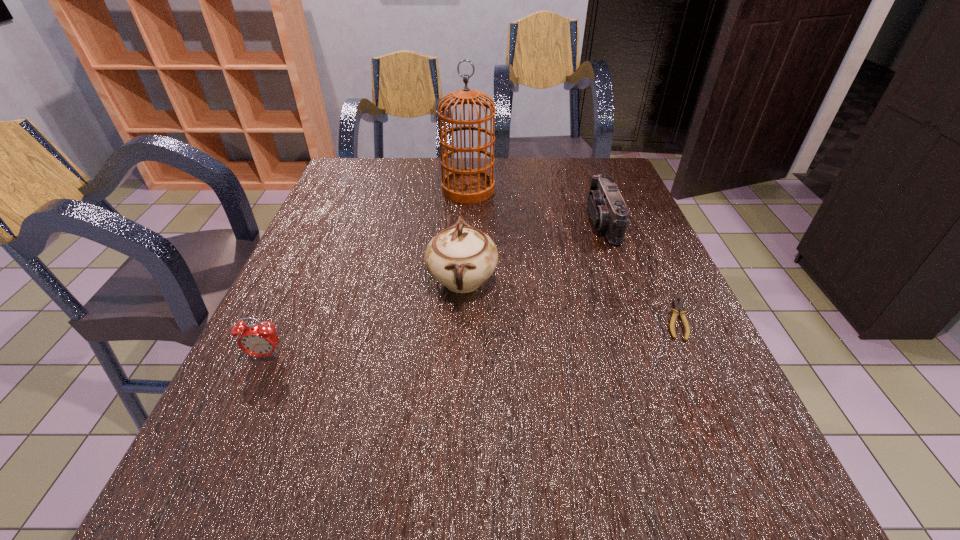
Locate an element on the screen. free region at the left edge of the desktop is located at coordinates (333, 349).

The height and width of the screenshot is (540, 960). I want to click on free space at the right edge, so click(654, 293).

Find the location of a particular element. This screenshot has width=960, height=540. free space at the near left corner of the desktop is located at coordinates (180, 521).

Locate an element on the screen. vacant space at the far right corner is located at coordinates (627, 195).

At what (x,y) coordinates should I click in order to perform the action: click on vacant point located between the camcorder and the shortest object. Please return your answer as a coordinate pair (x, y). The width and height of the screenshot is (960, 540). Looking at the image, I should click on [x=639, y=271].

The image size is (960, 540). Find the location of `free area in between the birdcage and the rightmost object`. free area in between the birdcage and the rightmost object is located at coordinates (572, 254).

I want to click on vacant point located between the chinaware and the rightmost object, so click(569, 300).

I want to click on free area in between the camcorder and the rightmost object, so click(x=639, y=271).

Find the location of `blank region between the shortest object and the second tallest object`. blank region between the shortest object and the second tallest object is located at coordinates (569, 300).

Identify the location of unoccupied area between the birdcage and the camcorder. This screenshot has width=960, height=540. (536, 206).